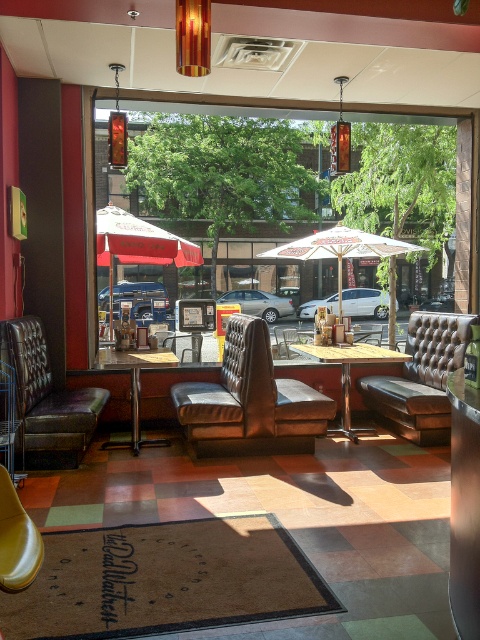
Question: Which is nearer to the brown leather couch at center?

Choices:
 (A) transparent glass window at center
 (B) yellow wood table at center

Answer: (B)

Question: Which object appears farthest from the camera in this image?

Choices:
 (A) brown leather armchair at center
 (B) transparent glass window at center

Answer: (B)

Question: Considering the relative positions of brown leather couch at left and white fabric umbrella at center in the image provided, where is brown leather couch at left located with respect to white fabric umbrella at center?

Choices:
 (A) below
 (B) above

Answer: (A)

Question: Estimate the real-world distances between objects in this image. Which object is farther from the transparent glass window at center?

Choices:
 (A) red fabric umbrella at center
 (B) wooden table at center

Answer: (B)

Question: Observing the image, what is the correct spatial positioning of yellow wood table at center in reference to wooden table at center?

Choices:
 (A) below
 (B) above

Answer: (B)

Question: Does brown leather armchair at center appear under white fabric umbrella at center?

Choices:
 (A) yes
 (B) no

Answer: (A)